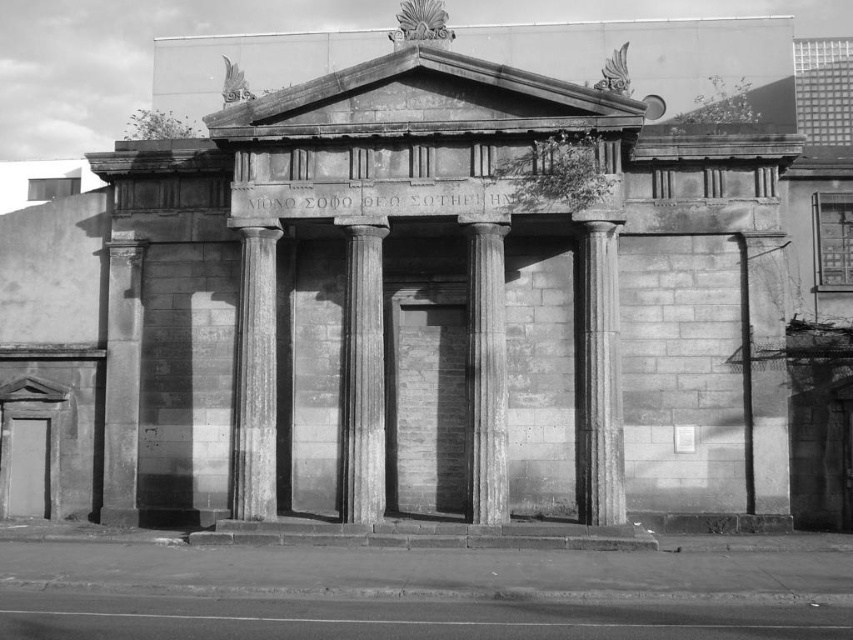
Question: Which is nearer to the gray stone column at left?

Choices:
 (A) smooth stone column at center
 (B) gray stone column at center

Answer: (B)

Question: Which object appears farthest from the camera in this image?

Choices:
 (A) gray stone column at left
 (B) smooth stone column at center
 (C) granite column at center
 (D) gray stone column at center

Answer: (A)

Question: Can you confirm if granite column at center is positioned to the left of smooth stone column at center?

Choices:
 (A) no
 (B) yes

Answer: (A)

Question: Among these objects, which one is farthest from the camera?

Choices:
 (A) gray stone column at center
 (B) gray stone column at left
 (C) granite column at center
 (D) smooth stone column at center

Answer: (B)

Question: Can you confirm if gray stone column at center is positioned to the right of gray stone column at left?

Choices:
 (A) yes
 (B) no

Answer: (A)

Question: Does granite column at center appear under smooth stone column at center?

Choices:
 (A) yes
 (B) no

Answer: (A)